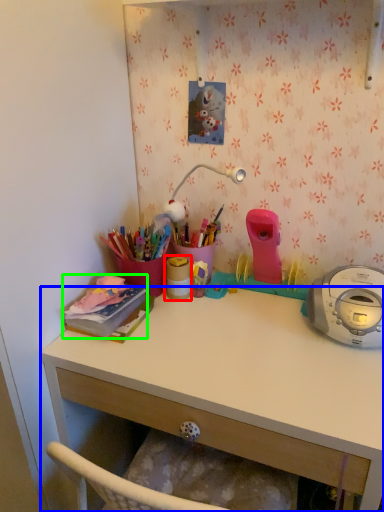
Question: Based on their relative distances, which object is nearer to office supplies (highlighted by a red box)? Choose from desk (highlighted by a blue box) and office supplies (highlighted by a green box).

Choices:
 (A) desk
 (B) office supplies

Answer: (B)